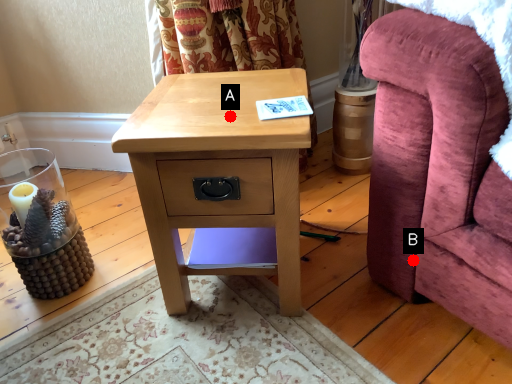
Question: Two points are circled on the image, labeled by A and B beside each circle. Which point is further to the camera?

Choices:
 (A) A is further
 (B) B is further

Answer: (B)